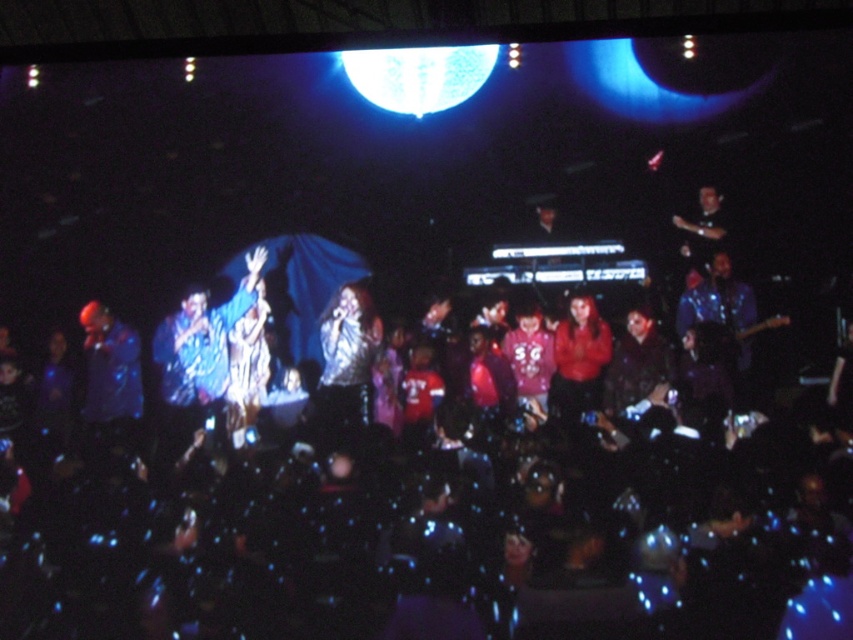
You are a photographer at the concert and want to capture both the shiny silver jacket at center and the matte red shirt at center in a single frame. Which object should you focus on first to ensure both are in the frame?

The shiny silver jacket at center is wider than the matte red shirt at center, so you should focus on the shiny silver jacket at center first to ensure both are in the frame.

You are a photographer at the concert and want to capture both the shiny silver jacket at center and the blue shiny jacket at left in a single shot. Which jacket should you focus on first to ensure both are in the frame?

The shiny silver jacket at center is located above the blue shiny jacket at left, so focus on the shiny silver jacket at center first to ensure both are in the frame.

You are a photographer trying to capture a clear photo of both the blue shiny jacket at left and the matte red shirt at center. Since you can only focus on one object at a time, which one should you focus on to ensure the other is also in focus?

You should focus on the blue shiny jacket at left because it is closer to you than the matte red shirt at center, so focusing on the closer object will keep the farther one in focus as well.